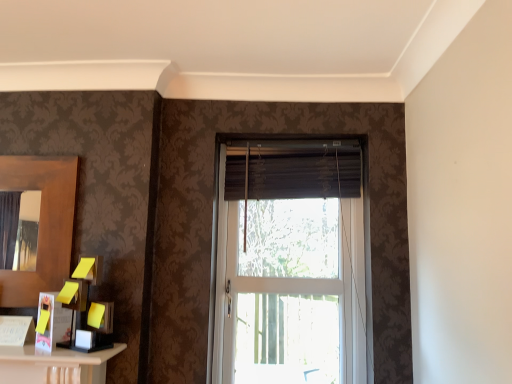
Question: Would you say dark brown fabric curtain at center is inside or outside white glass window at center?

Choices:
 (A) inside
 (B) outside

Answer: (A)

Question: Considering the positions of point (325, 165) and point (360, 244), is point (325, 165) closer or farther from the camera than point (360, 244)?

Choices:
 (A) farther
 (B) closer

Answer: (B)

Question: Which object is positioned closest to the brown wooden mirror at left?

Choices:
 (A) white glass window at center
 (B) dark brown fabric curtain at center

Answer: (B)

Question: Based on their relative distances, which object is nearer to the dark brown fabric curtain at center?

Choices:
 (A) white glass window at center
 (B) brown wooden mirror at left

Answer: (A)